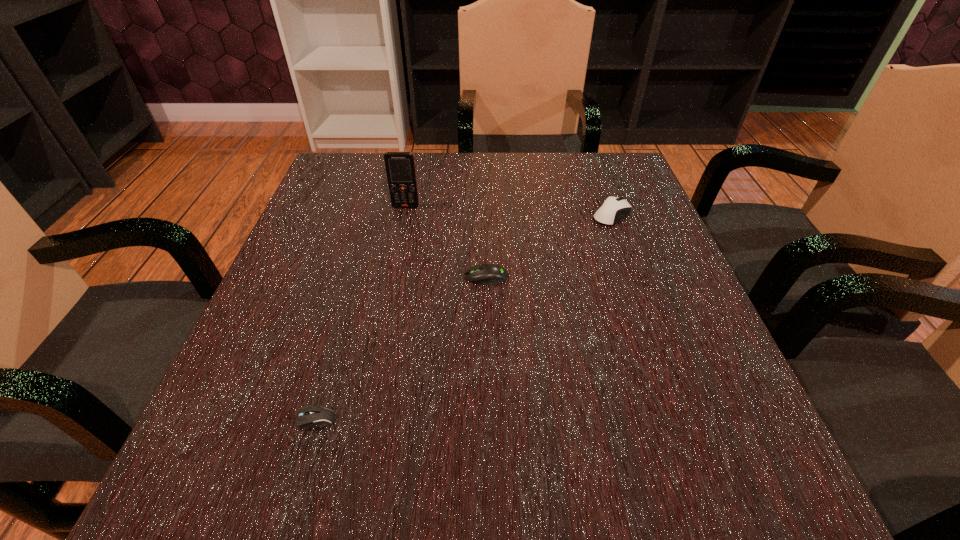
Identify the location of cellular telephone. Image resolution: width=960 pixels, height=540 pixels. pos(400,167).

Locate an element on the screen. The width and height of the screenshot is (960, 540). the third object from right to left is located at coordinates (400, 167).

Locate an element on the screen. This screenshot has width=960, height=540. the rightmost computer mouse is located at coordinates (613, 209).

This screenshot has width=960, height=540. In order to click on the third shortest object in this screenshot , I will do `click(613, 209)`.

Locate an element on the screen. the third farthest object is located at coordinates (483, 274).

You are a GUI agent. You are given a task and a screenshot of the screen. Output one action in this format:
    pyautogui.click(x=<x>, y=<y>)
    Task: Click on the third object from left to right
    The height and width of the screenshot is (540, 960).
    Given the screenshot: What is the action you would take?
    pyautogui.click(x=483, y=274)

I want to click on the nearest computer mouse, so click(310, 415).

At what (x,y) coordinates should I click in order to perform the action: click on the shortest computer mouse. Please return your answer as a coordinate pair (x, y). The image size is (960, 540). Looking at the image, I should click on (310, 415).

At what (x,y) coordinates should I click in order to perform the action: click on vacant area located on the screen of the third object from right to left. Please return your answer as a coordinate pair (x, y). The width and height of the screenshot is (960, 540). Looking at the image, I should click on (387, 298).

In order to click on vacant region located 0.170m on the front of the rightmost object in this screenshot , I will do `click(637, 284)`.